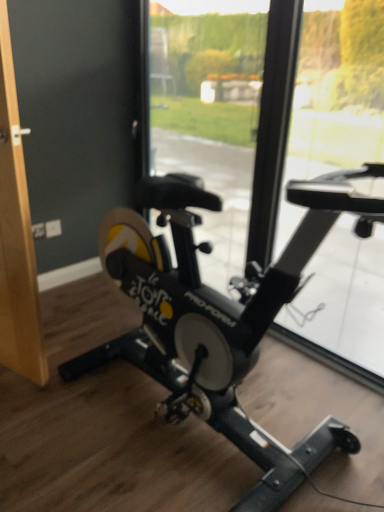
What do you see at coordinates (338, 89) in the screenshot? I see `transparent glass window at center, acting as the 2th window screen starting from the left` at bounding box center [338, 89].

Where is `transparent glass window at center, acting as the 2th window screen starting from the left`? transparent glass window at center, acting as the 2th window screen starting from the left is located at coordinates (338, 89).

Measure the distance between point (16, 170) and camera.

A distance of 4.68 feet exists between point (16, 170) and camera.

Locate an element on the screen. The height and width of the screenshot is (512, 384). wooden door handle at left is located at coordinates (16, 234).

In order to face transparent glass window at center, the 1th window screen positioned from the left, should I rotate leftwards or rightwards?

You should look right and rotate roughly 0.161 degrees.

Image resolution: width=384 pixels, height=512 pixels. What are the coordinates of `transparent glass window at center, which appears as the second window screen when viewed from the right` in the screenshot? It's located at (209, 112).

Where is `transparent glass window at center, arranged as the 1th window screen when viewed from the right`? This screenshot has height=512, width=384. transparent glass window at center, arranged as the 1th window screen when viewed from the right is located at coordinates click(x=338, y=89).

Considering the sizes of transparent glass window at center, arranged as the 1th window screen when viewed from the right, and wooden door handle at left in the image, is transparent glass window at center, arranged as the 1th window screen when viewed from the right, taller or shorter than wooden door handle at left?

Considering their sizes, transparent glass window at center, arranged as the 1th window screen when viewed from the right, has more height than wooden door handle at left.

Is transparent glass window at center, arranged as the 1th window screen when viewed from the right, oriented away from wooden door handle at left?

A: No, transparent glass window at center, arranged as the 1th window screen when viewed from the right,'s orientation is not away from wooden door handle at left.

Considering the relative positions of transparent glass window at center, acting as the 2th window screen starting from the left, and wooden door handle at left in the image provided, is transparent glass window at center, acting as the 2th window screen starting from the left, to the left of wooden door handle at left from the viewer's perspective?

Incorrect, transparent glass window at center, acting as the 2th window screen starting from the left, is not on the left side of wooden door handle at left.

Would you say transparent glass window at center, acting as the 2th window screen starting from the left, is outside black matte stationary bicycle at center?

Yes, transparent glass window at center, acting as the 2th window screen starting from the left, is not within black matte stationary bicycle at center.

Could you tell me if transparent glass window at center, acting as the 2th window screen starting from the left, is turned towards black matte stationary bicycle at center?

Yes, transparent glass window at center, acting as the 2th window screen starting from the left, faces towards black matte stationary bicycle at center.

Is transparent glass window at center, arranged as the 1th window screen when viewed from the right, bigger or smaller than black matte stationary bicycle at center?

Clearly, transparent glass window at center, arranged as the 1th window screen when viewed from the right, is smaller in size than black matte stationary bicycle at center.

Considering the positions of objects black matte stationary bicycle at center and transparent glass window at center, acting as the 2th window screen starting from the left, in the image provided, who is behind, black matte stationary bicycle at center or transparent glass window at center, acting as the 2th window screen starting from the left,?

transparent glass window at center, acting as the 2th window screen starting from the left, is more distant.

Looking at their sizes, would you say black matte stationary bicycle at center is wider or thinner than transparent glass window at center, arranged as the 1th window screen when viewed from the right?

Clearly, black matte stationary bicycle at center has more width compared to transparent glass window at center, arranged as the 1th window screen when viewed from the right.

From the image's perspective, which object appears higher, black matte stationary bicycle at center or transparent glass window at center, arranged as the 1th window screen when viewed from the right?

transparent glass window at center, arranged as the 1th window screen when viewed from the right.

From a real-world perspective, which is physically above, black matte stationary bicycle at center or transparent glass window at center, acting as the 2th window screen starting from the left?

transparent glass window at center, acting as the 2th window screen starting from the left, is physically above.

From the picture: Is transparent glass window at center, which appears as the second window screen when viewed from the right, inside or outside of black matte stationary bicycle at center?

transparent glass window at center, which appears as the second window screen when viewed from the right, cannot be found inside black matte stationary bicycle at center.

Can you tell me how much transparent glass window at center, the 1th window screen positioned from the left, and black matte stationary bicycle at center differ in facing direction?

0.0026 degrees.

Which of these two, transparent glass window at center, which appears as the second window screen when viewed from the right, or black matte stationary bicycle at center, is wider?

Wider between the two is black matte stationary bicycle at center.

From a real-world perspective, is transparent glass window at center, which appears as the second window screen when viewed from the right, over black matte stationary bicycle at center?

Yes.

Would you say transparent glass window at center, arranged as the 1th window screen when viewed from the right, is inside or outside transparent glass window at center, the 1th window screen positioned from the left?

transparent glass window at center, arranged as the 1th window screen when viewed from the right, is spatially situated outside transparent glass window at center, the 1th window screen positioned from the left.

Is point (330, 113) positioned behind point (253, 51)?

No, (330, 113) is closer to viewer.

From a real-world perspective, is transparent glass window at center, arranged as the 1th window screen when viewed from the right, positioned over transparent glass window at center, which appears as the second window screen when viewed from the right, based on gravity?

No.

How much distance is there between transparent glass window at center, arranged as the 1th window screen when viewed from the right, and transparent glass window at center, the 1th window screen positioned from the left?

transparent glass window at center, arranged as the 1th window screen when viewed from the right, and transparent glass window at center, the 1th window screen positioned from the left, are 19.59 inches apart.

Can you tell me how much transparent glass window at center, which appears as the second window screen when viewed from the right, and wooden door handle at left differ in facing direction?

The facing directions of transparent glass window at center, which appears as the second window screen when viewed from the right, and wooden door handle at left are 15.4 degrees apart.

Looking at this image, do you think transparent glass window at center, the 1th window screen positioned from the left, is within wooden door handle at left, or outside of it?

transparent glass window at center, the 1th window screen positioned from the left, lies outside wooden door handle at left.

Consider the image. From the image's perspective, is transparent glass window at center, which appears as the second window screen when viewed from the right, located above or below wooden door handle at left?

Based on their image positions, transparent glass window at center, which appears as the second window screen when viewed from the right, is located above wooden door handle at left.

Looking at this image, which is closer, [173,134] or [9,182]?

Clearly, point [173,134] is more distant from the camera than point [9,182].

I want to click on window screen below the transparent glass window at center, which appears as the second window screen when viewed from the right (from the image's perspective), so click(338, 89).

Is transparent glass window at center, which appears as the second window screen when viewed from the right, oriented away from transparent glass window at center, acting as the 2th window screen starting from the left?

No, transparent glass window at center, which appears as the second window screen when viewed from the right, is not facing away from transparent glass window at center, acting as the 2th window screen starting from the left.

Can you confirm if transparent glass window at center, which appears as the second window screen when viewed from the right, is smaller than transparent glass window at center, arranged as the 1th window screen when viewed from the right?

Actually, transparent glass window at center, which appears as the second window screen when viewed from the right, might be larger than transparent glass window at center, arranged as the 1th window screen when viewed from the right.

I want to click on screen door below the transparent glass window at center, arranged as the 1th window screen when viewed from the right (from a real-world perspective), so click(x=16, y=234).

Where is `stationary bicycle in front of the transparent glass window at center, acting as the 2th window screen starting from the left`? This screenshot has width=384, height=512. stationary bicycle in front of the transparent glass window at center, acting as the 2th window screen starting from the left is located at coordinates (218, 316).

Looking at the image, which one is located closer to transparent glass window at center, arranged as the 1th window screen when viewed from the right, wooden door handle at left or black matte stationary bicycle at center?

black matte stationary bicycle at center is positioned closer to the anchor transparent glass window at center, arranged as the 1th window screen when viewed from the right.

When comparing their distances from transparent glass window at center, which appears as the second window screen when viewed from the right, does black matte stationary bicycle at center or wooden door handle at left seem closer?

The object closer to transparent glass window at center, which appears as the second window screen when viewed from the right, is black matte stationary bicycle at center.

Based on their spatial positions, is wooden door handle at left or transparent glass window at center, acting as the 2th window screen starting from the left, closer to transparent glass window at center, which appears as the second window screen when viewed from the right?

transparent glass window at center, acting as the 2th window screen starting from the left, lies closer to transparent glass window at center, which appears as the second window screen when viewed from the right, than the other object.

Based on their spatial positions, is transparent glass window at center, acting as the 2th window screen starting from the left, or wooden door handle at left further from black matte stationary bicycle at center?

transparent glass window at center, acting as the 2th window screen starting from the left, is further to black matte stationary bicycle at center.

Based on their spatial positions, is transparent glass window at center, which appears as the second window screen when viewed from the right, or transparent glass window at center, acting as the 2th window screen starting from the left, closer to wooden door handle at left?

transparent glass window at center, which appears as the second window screen when viewed from the right, is closer to wooden door handle at left.

Looking at the image, which one is located further to transparent glass window at center, acting as the 2th window screen starting from the left, black matte stationary bicycle at center or wooden door handle at left?

wooden door handle at left is further to transparent glass window at center, acting as the 2th window screen starting from the left.

Looking at the image, which one is located closer to wooden door handle at left, transparent glass window at center, arranged as the 1th window screen when viewed from the right, or black matte stationary bicycle at center?

Based on the image, black matte stationary bicycle at center appears to be nearer to wooden door handle at left.

Estimate the real-world distances between objects in this image. Which object is further from transparent glass window at center, the 1th window screen positioned from the left, transparent glass window at center, acting as the 2th window screen starting from the left, or black matte stationary bicycle at center?

The object further to transparent glass window at center, the 1th window screen positioned from the left, is black matte stationary bicycle at center.

Locate an element on the screen. window screen between black matte stationary bicycle at center and transparent glass window at center, which appears as the second window screen when viewed from the right, from front to back is located at coordinates pos(338,89).

Where is `screen door between black matte stationary bicycle at center and transparent glass window at center, which appears as the second window screen when viewed from the right, in the front-back direction`? The height and width of the screenshot is (512, 384). screen door between black matte stationary bicycle at center and transparent glass window at center, which appears as the second window screen when viewed from the right, in the front-back direction is located at coordinates (16, 234).

Where is `window screen located between wooden door handle at left and transparent glass window at center, arranged as the 1th window screen when viewed from the right, in the left-right direction`? window screen located between wooden door handle at left and transparent glass window at center, arranged as the 1th window screen when viewed from the right, in the left-right direction is located at coordinates (209, 112).

Locate an element on the screen. The height and width of the screenshot is (512, 384). stationary bicycle between wooden door handle at left and transparent glass window at center, arranged as the 1th window screen when viewed from the right, in the horizontal direction is located at coordinates [x=218, y=316].